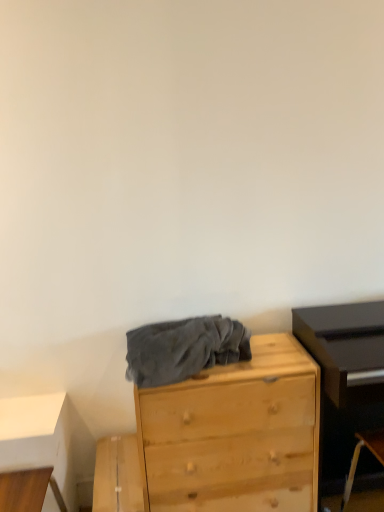
At what (x,y) coordinates should I click in order to perform the action: click on free space above wooden table at lower left (from a real-world perspective). Please return your answer as a coordinate pair (x, y). The height and width of the screenshot is (512, 384). Looking at the image, I should click on (22, 409).